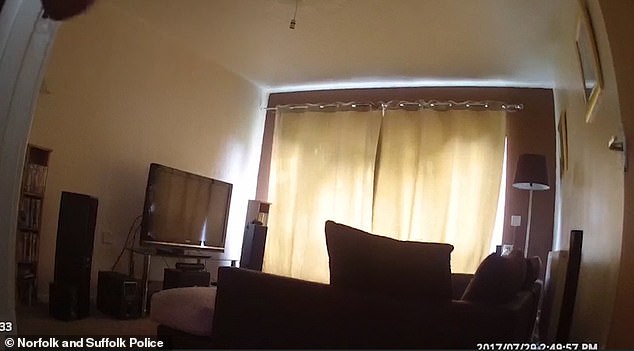
Find the location of `white painted walls`. white painted walls is located at coordinates (148, 110).